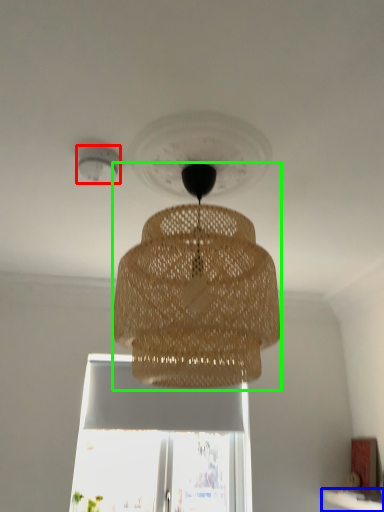
Question: Which is nearer to the lighting (highlighted by a red box)? window sill (highlighted by a blue box) or lamp (highlighted by a green box).

Choices:
 (A) window sill
 (B) lamp

Answer: (B)